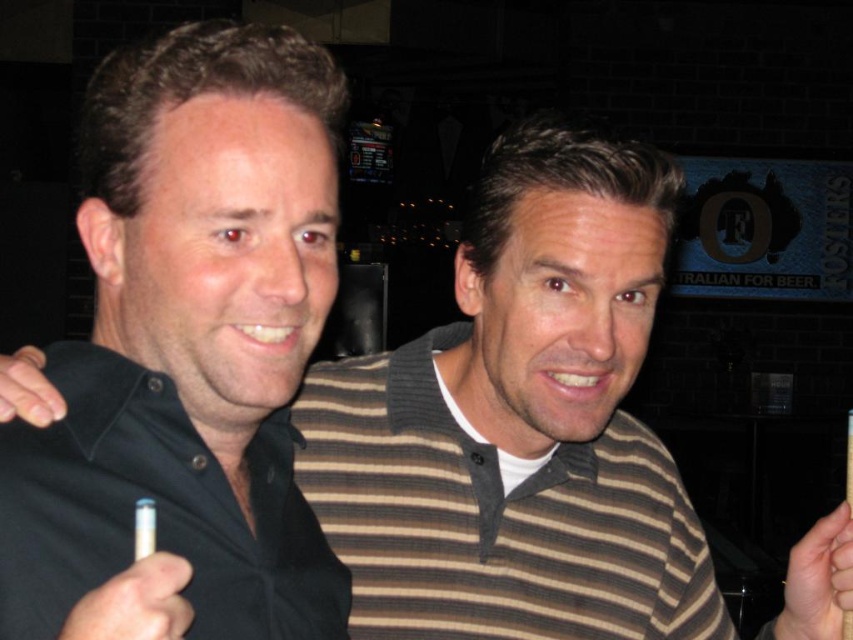
You are organizing a charity event and need to place the black cotton polo shirt at left and the white paper cigarette at lower left into boxes. The box for the polo shirt must be bigger than the one for the cigarette. Can you confirm if the current box sizes are appropriate based on their sizes?

The black cotton polo shirt at left is larger in size than the white paper cigarette at lower left, so the box for the black cotton polo shirt at left should indeed be bigger than the one for the white paper cigarette at lower left to accommodate its size.

From the picture: You are standing in front of the image and want to know the position of the black cotton polo shirt at left relative to the other person. Can you determine if it is positioned to the left or right of the person on the right?

The black cotton polo shirt at left is located at point (155, 509), which places it to the left of the person on the right.